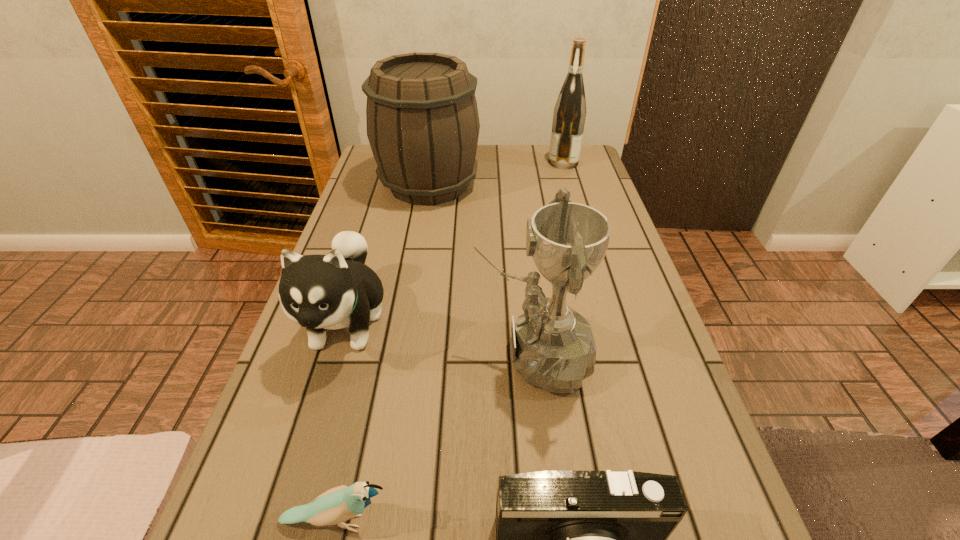
The image size is (960, 540). What are the coordinates of `free point between the wine bucket and the shortest object` in the screenshot? It's located at (383, 353).

Identify which object is located as the fifth nearest to the camcorder. Please provide its 2D coordinates. Your answer should be formatted as a tuple, i.e. [(x, y)], where the tuple contains the x and y coordinates of a point satisfying the conditions above.

[(569, 115)]

Image resolution: width=960 pixels, height=540 pixels. I want to click on object that is the third closest to the camcorder, so click(x=333, y=291).